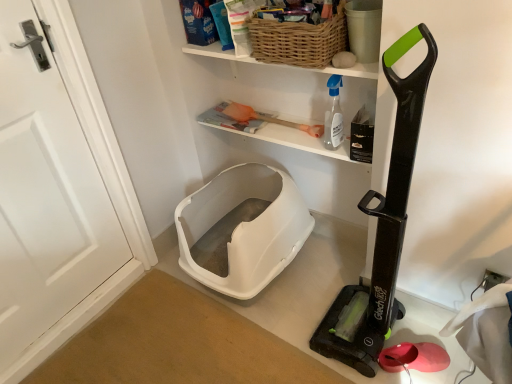
This screenshot has height=384, width=512. In order to click on free space that is in between black plastic vacuum cleaner at right and white plastic litter box at lower center in this screenshot , I will do `click(312, 289)`.